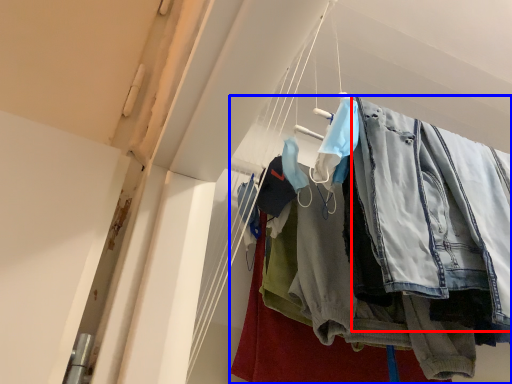
Question: Which point is closer to the camera, clothing (highlighted by a red box) or trousers (highlighted by a blue box)?

Choices:
 (A) clothing
 (B) trousers

Answer: (A)